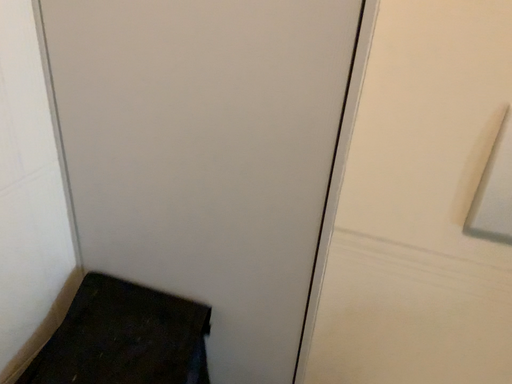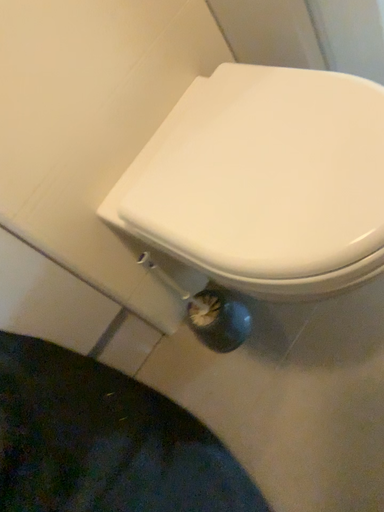
Question: Which way did the camera rotate in the video?

Choices:
 (A) rotated downward
 (B) rotated upward

Answer: (B)